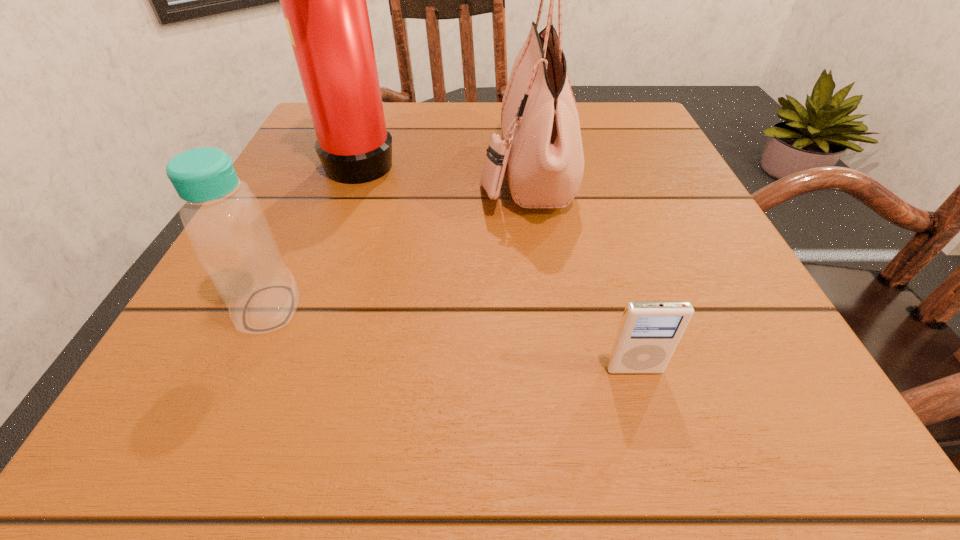
This screenshot has height=540, width=960. What are the coordinates of `fire extinguisher` in the screenshot? It's located at (324, 0).

Image resolution: width=960 pixels, height=540 pixels. In order to click on the third shortest object in this screenshot , I will do `click(541, 153)`.

What are the coordinates of `the third tallest object` in the screenshot? It's located at (224, 221).

In order to click on the second nearest object in this screenshot , I will do `click(224, 221)`.

Find the location of `the shortest object`. the shortest object is located at coordinates (649, 332).

Locate an element on the screen. This screenshot has width=960, height=540. the nearest object is located at coordinates (649, 332).

Locate an element on the screen. free location located at the spray nozzle of the fire extinguisher is located at coordinates (541, 159).

The height and width of the screenshot is (540, 960). What are the coordinates of `free location located on the side of the second tallest object with the attached pouch` in the screenshot? It's located at click(384, 171).

This screenshot has width=960, height=540. Identify the location of vacant area situated on the side of the second tallest object with the attached pouch. (342, 171).

In order to click on free space located on the side of the second tallest object with the attached pouch in this screenshot , I will do `click(384, 171)`.